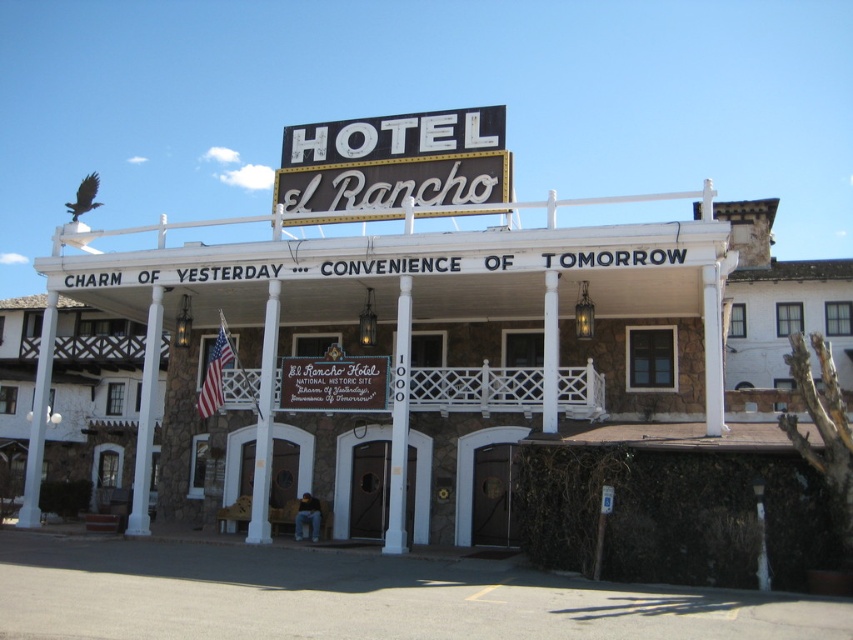
Question: Which point appears farthest from the camera in this image?

Choices:
 (A) (363, 129)
 (B) (148, 396)
 (C) (22, 506)
 (D) (137, 349)

Answer: (D)

Question: Where is white painted wood post at center located in relation to white painted wood pillar at center in the image?

Choices:
 (A) left
 (B) right

Answer: (B)

Question: Can you confirm if white painted wood post at center is smaller than white wood pillar at left?

Choices:
 (A) no
 (B) yes

Answer: (B)

Question: Which point is farther from the camera taking this photo?

Choices:
 (A) (144, 429)
 (B) (306, 371)

Answer: (A)

Question: Does white painted wood post at center have a greater width compared to white stone pillar at center?

Choices:
 (A) no
 (B) yes

Answer: (A)

Question: Estimate the real-world distances between objects in this image. Which object is farther from the white stone pillar at center?

Choices:
 (A) metallic gold sign at center
 (B) white wood pillar at left

Answer: (A)